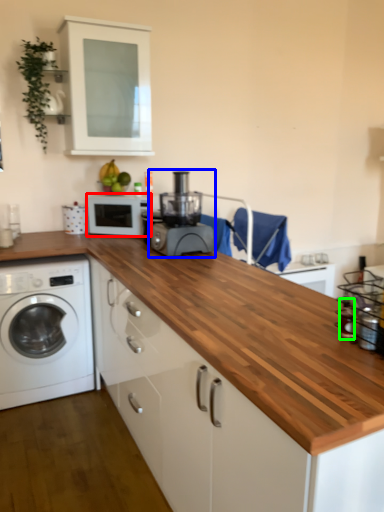
Question: Which object is positioned closest to microwave oven (highlighted by a red box)? Select from home appliance (highlighted by a blue box) and bottle (highlighted by a green box).

Choices:
 (A) home appliance
 (B) bottle

Answer: (A)